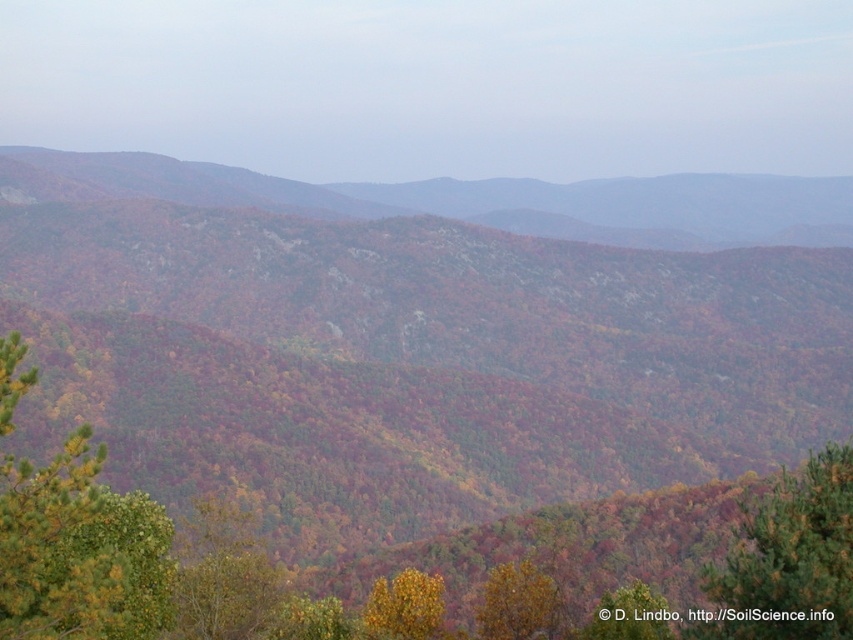
You are standing at the point marked as point (405, 605) in the image. What object is located exactly at that point?

The yellow matte tree at lower center is located exactly at point (405, 605).